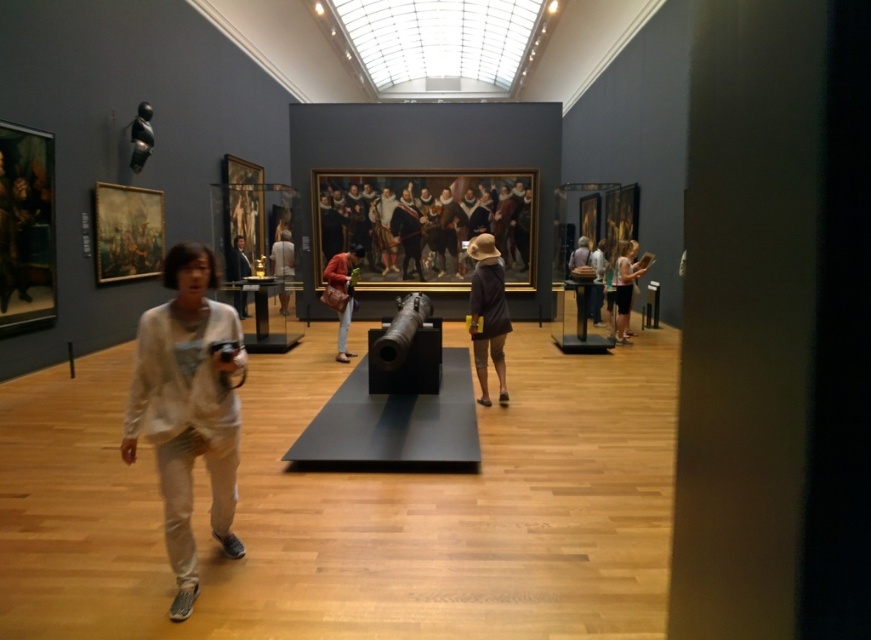
Question: Which point is closer to the camera taking this photo?

Choices:
 (A) (173, 365)
 (B) (282, 241)

Answer: (A)

Question: Among these objects, which one is farthest from the camera?

Choices:
 (A) dark gray fabric hat at center
 (B) white cotton shirt at lower left
 (C) matte black jacket at center
 (D) white fabric dress at center

Answer: (D)

Question: Does light brown shorts at center lie behind matte black jacket at center?

Choices:
 (A) yes
 (B) no

Answer: (B)

Question: Can you confirm if white cotton shirt at lower left is positioned below white fabric dress at center?

Choices:
 (A) no
 (B) yes

Answer: (B)

Question: Among these points, which one is farthest from the camera?

Choices:
 (A) (487, 248)
 (B) (326, 301)
 (C) (221, 378)

Answer: (B)

Question: Is matte red jacket at center to the left of white fabric dress at center from the viewer's perspective?

Choices:
 (A) yes
 (B) no

Answer: (B)